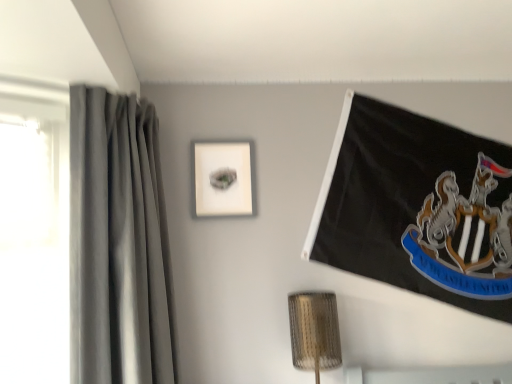
The width and height of the screenshot is (512, 384). Describe the element at coordinates (118, 243) in the screenshot. I see `gray fabric curtain at left` at that location.

Locate an element on the screen. This screenshot has height=384, width=512. gray fabric curtain at left is located at coordinates (118, 243).

Consider the image. Measure the distance between point [142,132] and camera.

Point [142,132] is 5.68 feet from camera.

Image resolution: width=512 pixels, height=384 pixels. What do you see at coordinates (223, 178) in the screenshot?
I see `matte white picture frame at center` at bounding box center [223, 178].

Measure the distance between point (248,215) and camera.

The distance of point (248,215) from camera is 6.79 feet.

This screenshot has height=384, width=512. I want to click on matte white picture frame at center, so click(x=223, y=178).

Locate an element on the screen. gray fabric curtain at left is located at coordinates (118, 243).

Which object is positioned more to the right, gray fabric curtain at left or matte white picture frame at center?

A: matte white picture frame at center is more to the right.

Is gray fabric curtain at left positioned before matte white picture frame at center?

Yes, gray fabric curtain at left is in front of matte white picture frame at center.

Is point (163, 300) farther from viewer compared to point (223, 194)?

No, (163, 300) is closer to viewer.

From the image's perspective, is gray fabric curtain at left located above or below matte white picture frame at center?

gray fabric curtain at left is situated lower than matte white picture frame at center in the image.

From a real-world perspective, between gray fabric curtain at left and matte white picture frame at center, who is vertically higher?

matte white picture frame at center.

Considering the sizes of gray fabric curtain at left and matte white picture frame at center in the image, is gray fabric curtain at left wider or thinner than matte white picture frame at center?

In the image, gray fabric curtain at left appears to be wider than matte white picture frame at center.

Considering the relative sizes of gray fabric curtain at left and matte white picture frame at center in the image provided, is gray fabric curtain at left shorter than matte white picture frame at center?

In fact, gray fabric curtain at left may be taller than matte white picture frame at center.

Considering the relative sizes of gray fabric curtain at left and matte white picture frame at center in the image provided, is gray fabric curtain at left smaller than matte white picture frame at center?

No.

Would you say gray fabric curtain at left contains matte white picture frame at center?

No, matte white picture frame at center is not a part of gray fabric curtain at left.

Is there a large distance between gray fabric curtain at left and matte white picture frame at center?

No, there isn't a large distance between gray fabric curtain at left and matte white picture frame at center.

Is gray fabric curtain at left oriented towards matte white picture frame at center?

Yes, gray fabric curtain at left is turned towards matte white picture frame at center.

Can you tell me how much gray fabric curtain at left and matte white picture frame at center differ in facing direction?

There is a 92.3-degree angle between the facing directions of gray fabric curtain at left and matte white picture frame at center.

I want to click on picture frame located behind the gray fabric curtain at left, so click(223, 178).

Between matte white picture frame at center and gray fabric curtain at left, which one appears on the right side from the viewer's perspective?

From the viewer's perspective, matte white picture frame at center appears more on the right side.

Does matte white picture frame at center lie in front of gray fabric curtain at left?

No, it is not.

Which point is more distant from viewer, (227, 144) or (146, 357)?

The point (227, 144) is farther.

Looking at this image, from the image's perspective, between matte white picture frame at center and gray fabric curtain at left, which one is located above?

matte white picture frame at center.

From a real-world perspective, between matte white picture frame at center and gray fabric curtain at left, who is vertically higher?

matte white picture frame at center, from a real-world perspective.

Can you confirm if matte white picture frame at center is thinner than gray fabric curtain at left?

Correct, the width of matte white picture frame at center is less than that of gray fabric curtain at left.

Considering the sizes of objects matte white picture frame at center and gray fabric curtain at left in the image provided, who is taller, matte white picture frame at center or gray fabric curtain at left?

gray fabric curtain at left is taller.

Can you confirm if matte white picture frame at center is smaller than gray fabric curtain at left?

Indeed, matte white picture frame at center has a smaller size compared to gray fabric curtain at left.

Which is correct: matte white picture frame at center is inside gray fabric curtain at left, or outside of it?

matte white picture frame at center is spatially situated outside gray fabric curtain at left.

Are matte white picture frame at center and gray fabric curtain at left far apart?

No.

Consider the image. Is matte white picture frame at center turned away from gray fabric curtain at left?

matte white picture frame at center is not turned away from gray fabric curtain at left.

In the scene shown: Can you tell me how much matte white picture frame at center and gray fabric curtain at left differ in facing direction?

The angle between the facing direction of matte white picture frame at center and the facing direction of gray fabric curtain at left is 92.3 degrees.

Find the location of a particular element. This screenshot has height=384, width=512. picture frame located behind the gray fabric curtain at left is located at coordinates (223, 178).

The width and height of the screenshot is (512, 384). In the image, there is a gray fabric curtain at left. Identify the location of picture frame above it (from the image's perspective). (223, 178).

The image size is (512, 384). Identify the location of picture frame above the gray fabric curtain at left (from a real-world perspective). (223, 178).